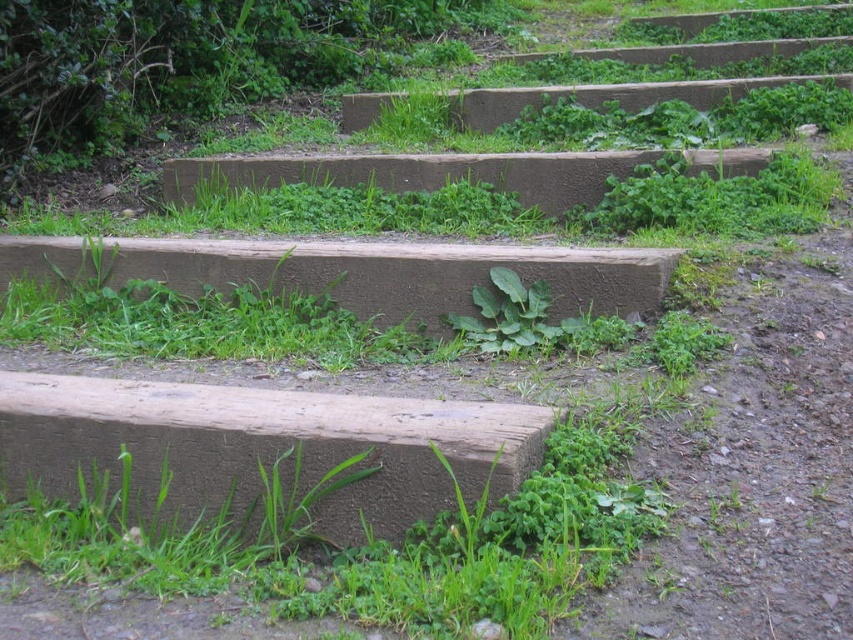
Does brown rough concrete at lower left appear on the right side of brown rough concrete at center?

Incorrect, brown rough concrete at lower left is not on the right side of brown rough concrete at center.

Can you confirm if brown rough concrete at lower left is taller than brown rough concrete at center?

No.

This screenshot has height=640, width=853. I want to click on brown rough concrete at lower left, so click(260, 451).

How much distance is there between brown rough concrete at center and green leafy plant at center?

They are 22.04 centimeters apart.

Between point (473, 291) and point (525, 348), which one is positioned in front?

Point (525, 348)

In order to click on brown rough concrete at center in this screenshot , I will do `click(314, 285)`.

Who is positioned more to the right, brown rough concrete at lower left or green leafy plant at center?

Positioned to the right is green leafy plant at center.

Between brown rough concrete at lower left and green leafy plant at center, which one is positioned higher?

green leafy plant at center is above.

Is point (421, 400) positioned in front of point (520, 282)?

Yes, point (421, 400) is in front of point (520, 282).

I want to click on brown rough concrete at lower left, so click(260, 451).